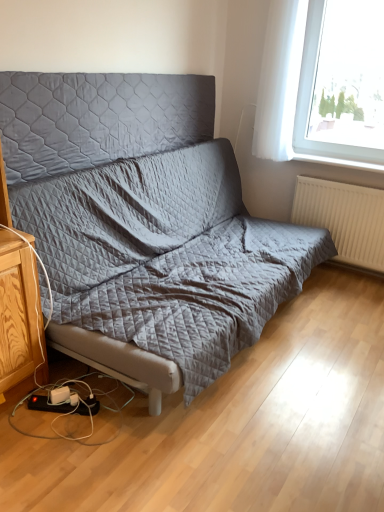
The image size is (384, 512). Identify the location of free area in between quilted fabric studio couch at center and white textured radiator at right. (322, 327).